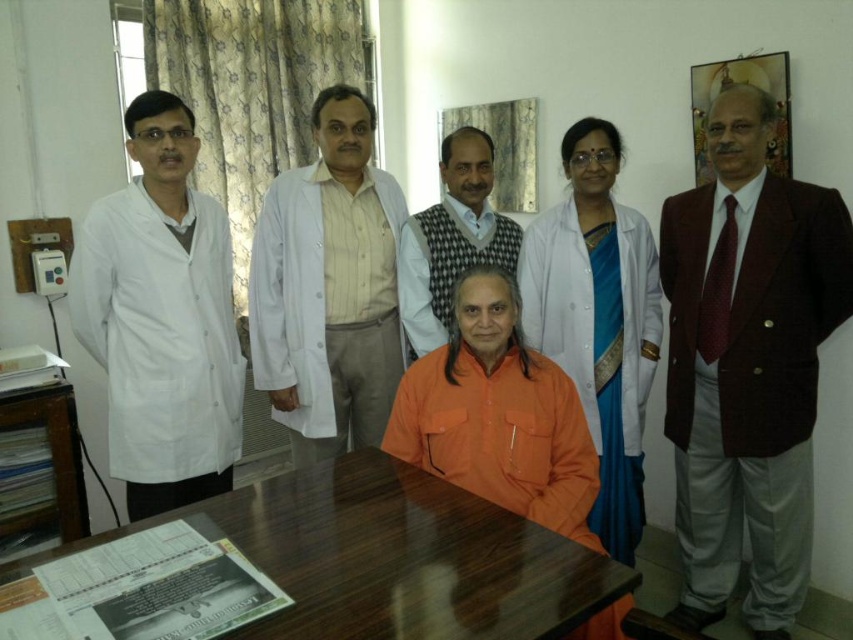
Question: From the image, what is the correct spatial relationship of white matte lab coat at left in relation to orange cotton shirt at center?

Choices:
 (A) above
 (B) below

Answer: (A)

Question: Is white matte lab coat at center further to camera compared to orange cotton shirt at center?

Choices:
 (A) yes
 (B) no

Answer: (A)

Question: Among these points, which one is nearest to the camera?

Choices:
 (A) (469, 301)
 (B) (306, 602)
 (C) (379, 349)
 (D) (161, 467)

Answer: (B)

Question: Among these points, which one is nearest to the camera?

Choices:
 (A) (576, 150)
 (B) (485, 410)
 (C) (187, 189)
 (D) (463, 588)

Answer: (D)

Question: Which point is closer to the camera?

Choices:
 (A) white matte lab coat at center
 (B) white lab coat at center

Answer: (A)

Question: Can you confirm if maroon fabric suit at right is positioned above orange cotton shirt at center?

Choices:
 (A) no
 (B) yes

Answer: (B)